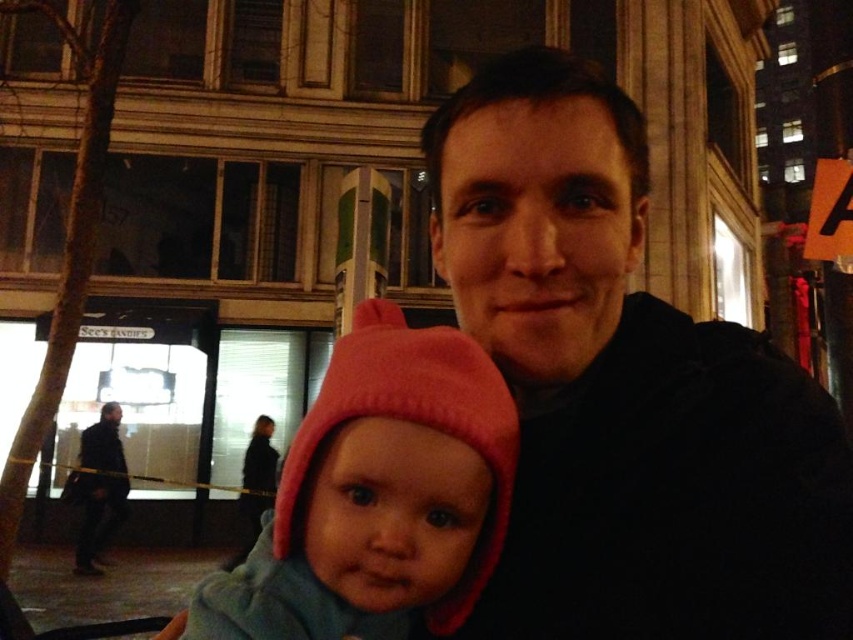
Who is positioned more to the right, black matte jacket at center or pink fleece hat at center?

black matte jacket at center is more to the right.

Which is in front, point (622, 625) or point (285, 506)?

Point (285, 506) is in front.

Identify the location of black matte jacket at center. This screenshot has height=640, width=853. [625, 388].